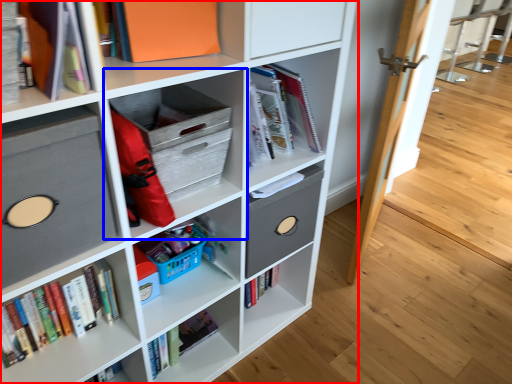
Question: Among these objects, which one is nearest to the camera, shelf (highlighted by a red box) or shelf (highlighted by a blue box)?

Choices:
 (A) shelf
 (B) shelf

Answer: (A)